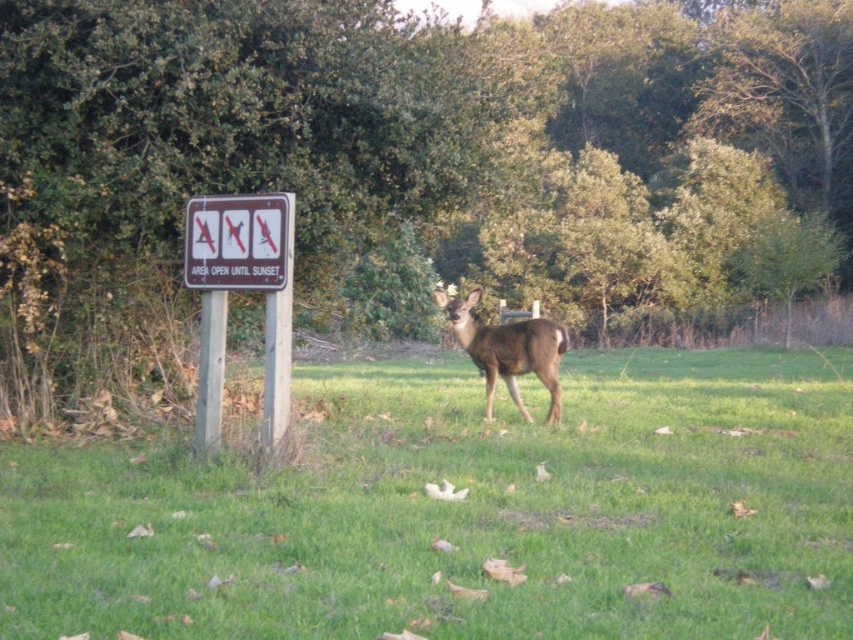
You are a hiker who wants to take a photo of the brown wooden sign at left and the brown matte deer at center. Which object should you zoom in on to capture both in the frame without moving your camera?

The brown wooden sign at left is thinner than the brown matte deer at center, so you should zoom in on the brown matte deer at center to ensure both fit in the frame.

You are a hiker who just entered the trail and see the brown wooden sign at left and the metallic rectangular sign at center. Which sign is taller?

The brown wooden sign at left is much taller than the metallic rectangular sign at center.